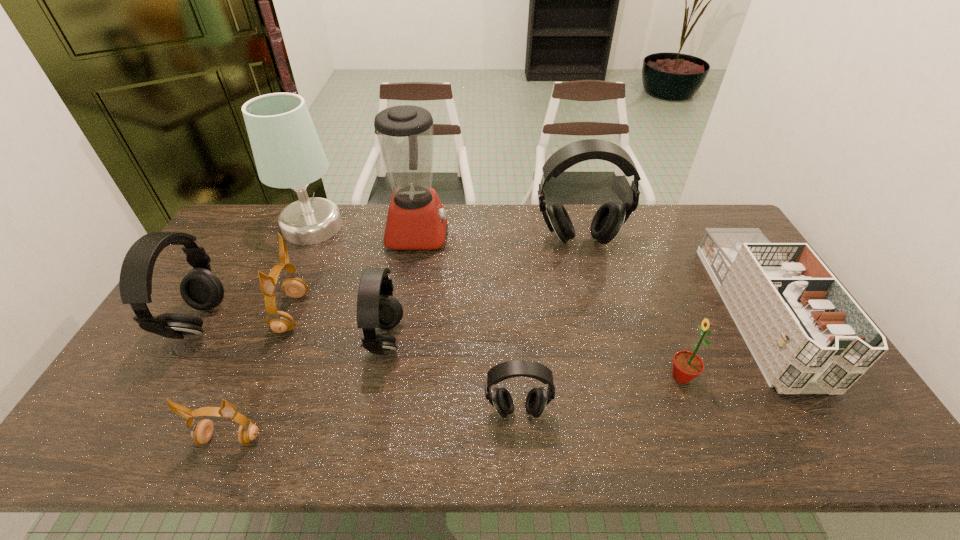
Where is `free space in the image that satisfies the following two spatial constraints: 1. on the ear cups of the biggest black earphone; 2. on the ear cups of the leftmost object`? The width and height of the screenshot is (960, 540). free space in the image that satisfies the following two spatial constraints: 1. on the ear cups of the biggest black earphone; 2. on the ear cups of the leftmost object is located at coordinates (600, 323).

I want to click on blank area in the image that satisfies the following two spatial constraints: 1. on the ear cups of the farthest earphone; 2. on the ear cups of the leftmost black earphone, so click(x=600, y=323).

I want to click on free location that satisfies the following two spatial constraints: 1. on the ear cups of the third biggest black earphone; 2. on the front-facing side of the nearest object, so click(x=367, y=438).

I want to click on vacant space that satisfies the following two spatial constraints: 1. on the front of the blender near the controls; 2. on the front-facing side of the nearest earphone, so click(x=385, y=438).